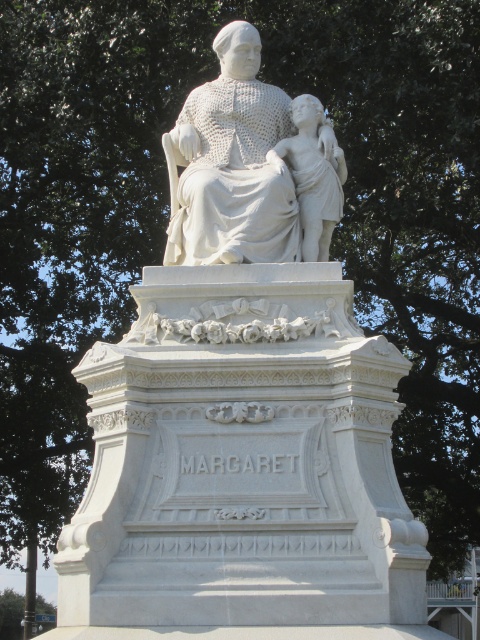
Is white marble statue at center in front of green leafy tree at lower left?

Yes, it is in front of green leafy tree at lower left.

Who is positioned more to the left, white marble statue at center or green leafy tree at lower left?

green leafy tree at lower left is more to the left.

Measure the distance between point (220, 182) and camera.

Point (220, 182) is 211.25 feet away from camera.

I want to click on white marble statue at center, so tap(231, 164).

Between white marble statue at center and white marble child at center, which one appears on the right side from the viewer's perspective?

From the viewer's perspective, white marble child at center appears more on the right side.

In the scene shown: Does white marble statue at center have a greater width compared to white marble child at center?

Indeed, white marble statue at center has a greater width compared to white marble child at center.

The width and height of the screenshot is (480, 640). Identify the location of white marble statue at center. (231, 164).

Who is higher up, white marble child at center or green leafy tree at lower left?

white marble child at center is higher up.

How distant is white marble child at center from green leafy tree at lower left?

The distance of white marble child at center from green leafy tree at lower left is 83.69 meters.

Who is more distant from viewer, (303, 228) or (0, 612)?

The point (0, 612) is more distant.

I want to click on white marble child at center, so click(x=312, y=173).